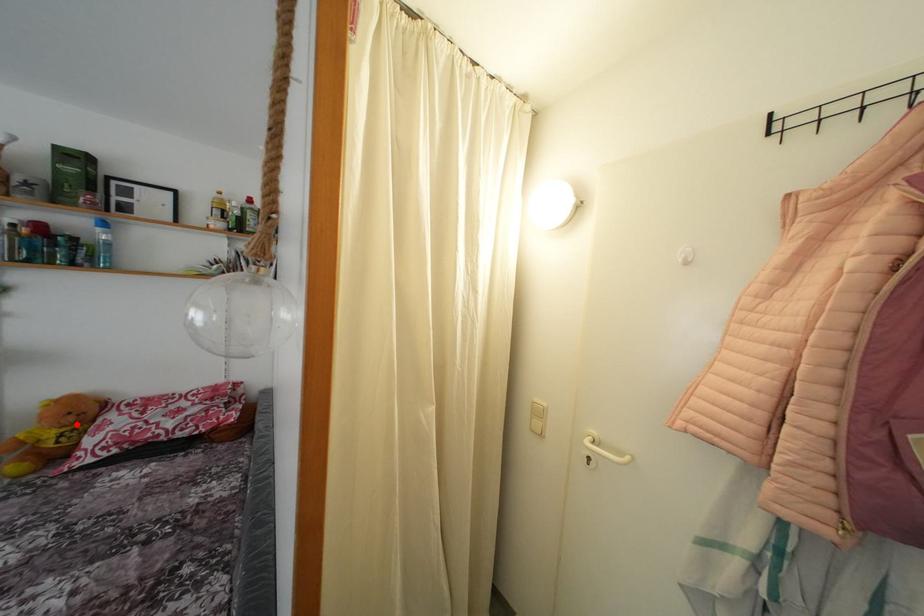
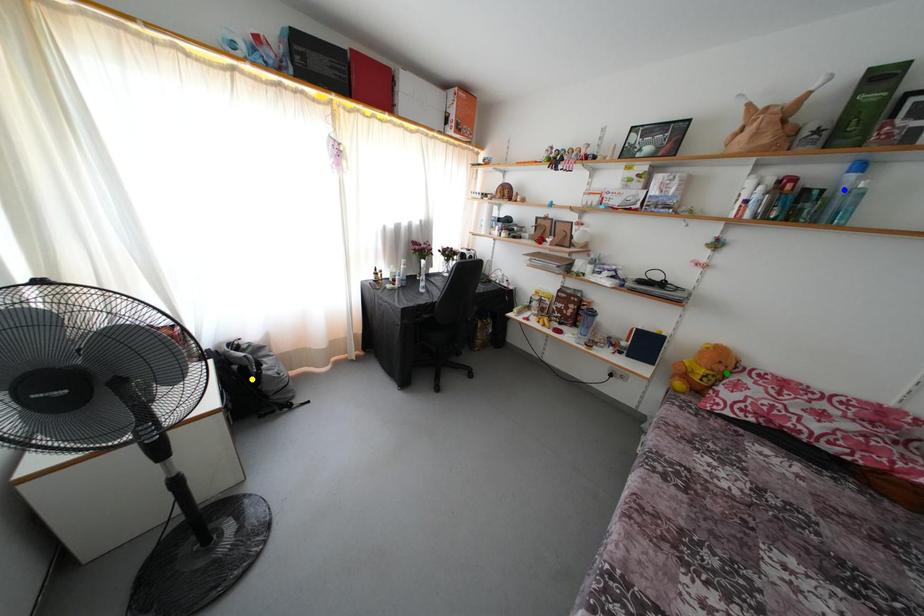
Question: I am providing you with two images of the same scene from different viewpoints. A red point is marked on the first image. You are given multiple points on the second image. Which point in image 2 is actually the same real-world point as the red point in image 1?

Choices:
 (A) yellow point
 (B) green point
 (C) blue point

Answer: (B)